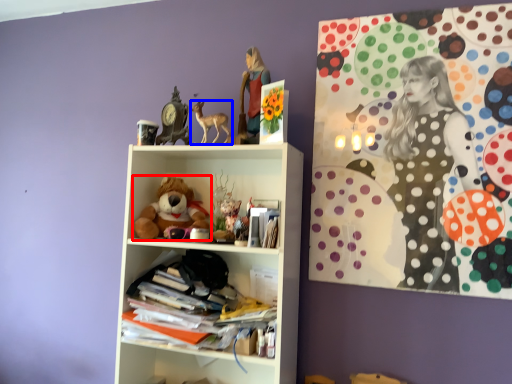
Question: Which object is closer to the camera taking this photo, teddy bear (highlighted by a red box) or toy (highlighted by a blue box)?

Choices:
 (A) teddy bear
 (B) toy

Answer: (B)